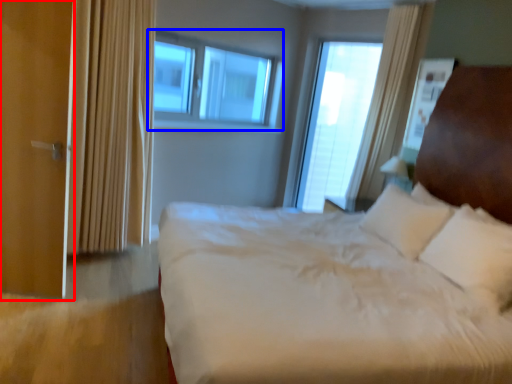
Question: Which point is closer to the camera, screen door (highlighted by a red box) or window (highlighted by a blue box)?

Choices:
 (A) screen door
 (B) window

Answer: (A)